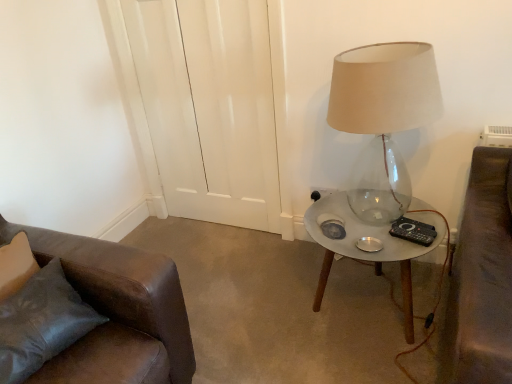
Where is `free space behind black plastic remote control at right`? This screenshot has height=384, width=512. free space behind black plastic remote control at right is located at coordinates (394, 211).